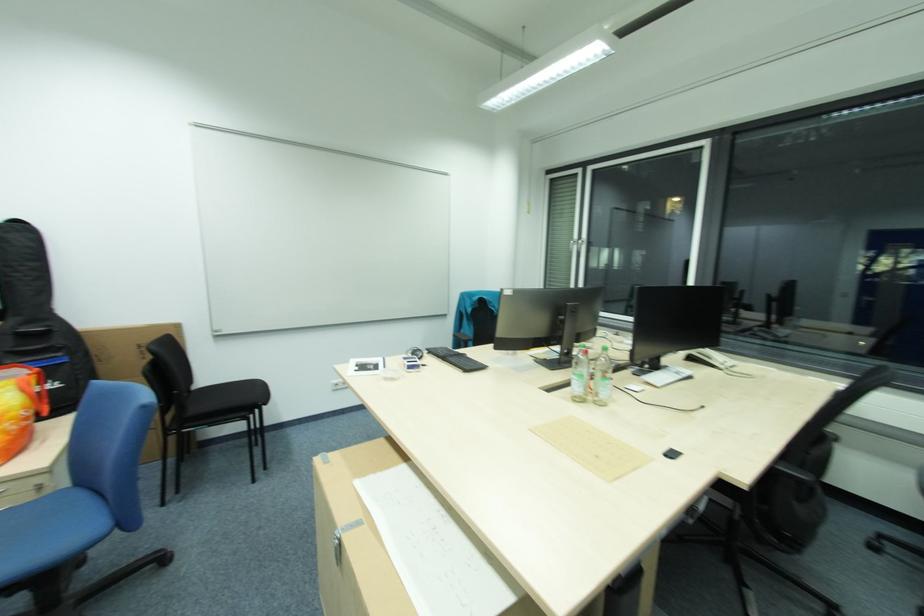
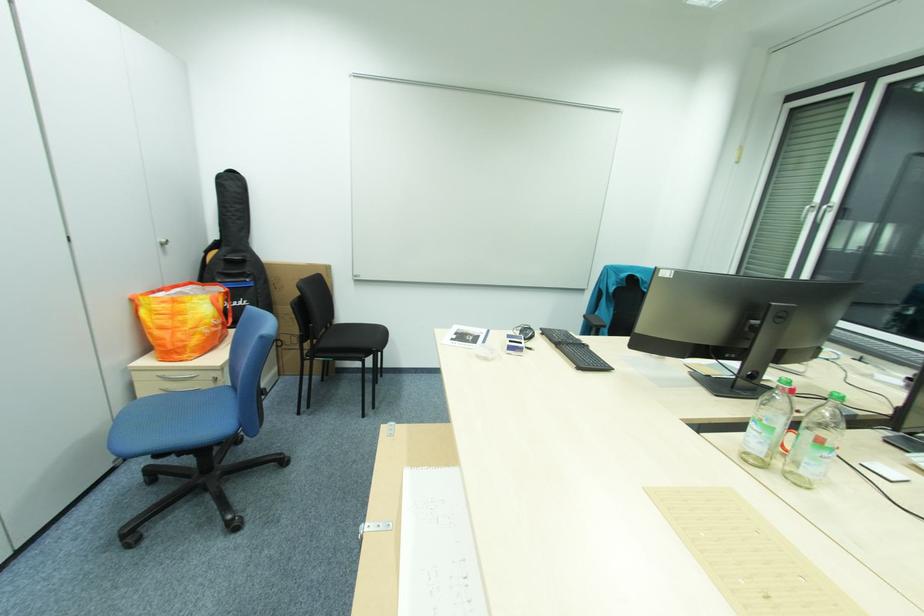
Question: The images are taken continuously from a first-person perspective. In which direction are you moving?

Choices:
 (A) Left
 (B) Right
 (C) Forward
 (D) Backward

Answer: (C)